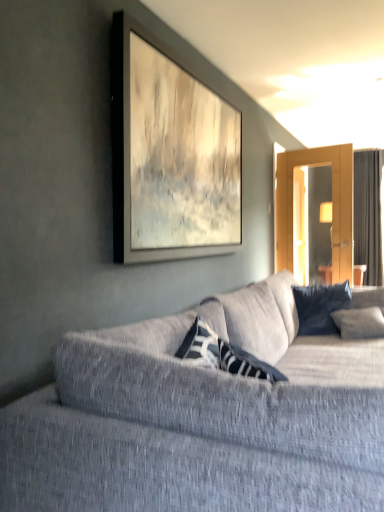
What do you see at coordinates (201, 419) in the screenshot?
I see `textured gray couch at center` at bounding box center [201, 419].

Where is `dark gray fabric curtain at right`? Image resolution: width=384 pixels, height=512 pixels. dark gray fabric curtain at right is located at coordinates (368, 214).

Image resolution: width=384 pixels, height=512 pixels. Find the location of `textured gray couch at center`. textured gray couch at center is located at coordinates (201, 419).

Does dark gray fabric curtain at right touch dark blue textured pillow at center?

No, dark gray fabric curtain at right is not making contact with dark blue textured pillow at center.

Is dark gray fabric curtain at right spatially inside dark blue textured pillow at center, or outside of it?

dark gray fabric curtain at right lies outside dark blue textured pillow at center.

Between dark gray fabric curtain at right and dark blue textured pillow at center, which one has less height?

dark blue textured pillow at center.

Which of these two, dark gray fabric curtain at right or dark blue textured pillow at center, is smaller?

Smaller between the two is dark blue textured pillow at center.

Between textured gray couch at center and dark blue textured pillow at center, which one has smaller width?

dark blue textured pillow at center.

Between textured gray couch at center and dark blue textured pillow at center, which one is positioned in front?

textured gray couch at center is closer to the camera.

Is textured gray couch at center positioned with its back to dark blue textured pillow at center?

textured gray couch at center does not have its back to dark blue textured pillow at center.

Consider the image. Who is more distant, textured gray couch at center or dark gray fabric curtain at right?

dark gray fabric curtain at right.

From a real-world perspective, which is physically below, textured gray couch at center or dark gray fabric curtain at right?

textured gray couch at center, from a real-world perspective.

Where is `studio couch on the left of dark gray fabric curtain at right`? Image resolution: width=384 pixels, height=512 pixels. studio couch on the left of dark gray fabric curtain at right is located at coordinates (201, 419).

Identify the location of curtain above the textured gray couch at center (from the image's perspective). The image size is (384, 512). (368, 214).

Which of these two, dark gray fabric curtain at right or textured gray couch at center, is wider?

With larger width is textured gray couch at center.

Considering the sizes of dark gray fabric curtain at right and textured gray couch at center in the image, is dark gray fabric curtain at right bigger or smaller than textured gray couch at center?

Clearly, dark gray fabric curtain at right is smaller in size than textured gray couch at center.

From a real-world perspective, which is physically above, dark gray fabric curtain at right or textured gray couch at center?

dark gray fabric curtain at right.

Is dark blue textured pillow at center to the right of textured gray couch at center from the viewer's perspective?

Yes.

Is textured gray couch at center located within dark blue textured pillow at center?

That's incorrect, textured gray couch at center is not inside dark blue textured pillow at center.

From the image's perspective, is dark blue textured pillow at center beneath textured gray couch at center?

Incorrect, from the image's perspective, dark blue textured pillow at center is higher than textured gray couch at center.

In the scene shown: From a real-world perspective, is dark blue textured pillow at center physically below textured gray couch at center?

No.

Is dark blue textured pillow at center oriented towards dark gray fabric curtain at right?

No, dark blue textured pillow at center is not turned towards dark gray fabric curtain at right.

In the scene shown: Considering the positions of objects dark blue textured pillow at center and dark gray fabric curtain at right in the image provided, who is more to the left, dark blue textured pillow at center or dark gray fabric curtain at right?

From the viewer's perspective, dark blue textured pillow at center appears more on the left side.

Considering the positions of point (334, 305) and point (368, 255), is point (334, 305) closer or farther from the camera than point (368, 255)?

Point (334, 305) is closer to the camera than point (368, 255).

The image size is (384, 512). In the image, there is a dark gray fabric curtain at right. In order to click on pillow below it (from a real-world perspective) in this screenshot , I will do `click(320, 307)`.

The image size is (384, 512). Find the location of `pillow lying on the right of textured gray couch at center`. pillow lying on the right of textured gray couch at center is located at coordinates (320, 307).

Estimate the real-world distances between objects in this image. Which object is further from dark blue textured pillow at center, dark gray fabric curtain at right or textured gray couch at center?

textured gray couch at center.

When comparing their distances from dark gray fabric curtain at right, does textured gray couch at center or dark blue textured pillow at center seem further?

The object further to dark gray fabric curtain at right is textured gray couch at center.

Which object lies further to the anchor point dark gray fabric curtain at right, dark blue textured pillow at center or textured gray couch at center?

textured gray couch at center is further to dark gray fabric curtain at right.

Which object lies further to the anchor point dark blue textured pillow at center, textured gray couch at center or dark gray fabric curtain at right?

Based on the image, textured gray couch at center appears to be further to dark blue textured pillow at center.

Looking at the image, which one is located closer to textured gray couch at center, dark blue textured pillow at center or dark gray fabric curtain at right?

dark blue textured pillow at center lies closer to textured gray couch at center than the other object.

Based on their spatial positions, is dark gray fabric curtain at right or dark blue textured pillow at center further from textured gray couch at center?

The object further to textured gray couch at center is dark gray fabric curtain at right.

Where is `pillow located between textured gray couch at center and dark gray fabric curtain at right in the depth direction`? pillow located between textured gray couch at center and dark gray fabric curtain at right in the depth direction is located at coordinates (320, 307).